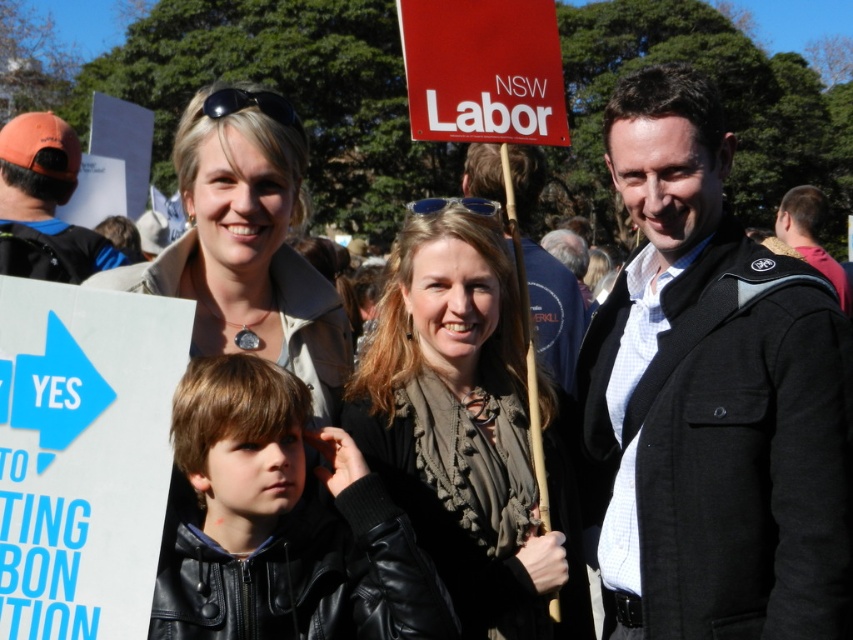
Question: Can you confirm if ruffled fabric shirt at center is positioned below orange fabric cap at left?

Choices:
 (A) no
 (B) yes

Answer: (B)

Question: Which object appears farthest from the camera in this image?

Choices:
 (A) dark brown leather jacket at right
 (B) orange fabric cap at left
 (C) matte black jacket at right

Answer: (B)

Question: Where is light beige coat at center located in relation to matte black jacket at right in the image?

Choices:
 (A) below
 (B) above

Answer: (A)

Question: Does light beige coat at center have a lesser width compared to matte black jacket at right?

Choices:
 (A) yes
 (B) no

Answer: (B)

Question: Which point is farther to the camera?

Choices:
 (A) (27, 198)
 (B) (503, 332)
 (C) (811, 611)
 (D) (779, 228)

Answer: (D)

Question: Considering the real-world distances, which object is closest to the black wool coat at center?

Choices:
 (A) matte black jacket at right
 (B) black leather jacket at center
 (C) dark brown leather jacket at right

Answer: (A)